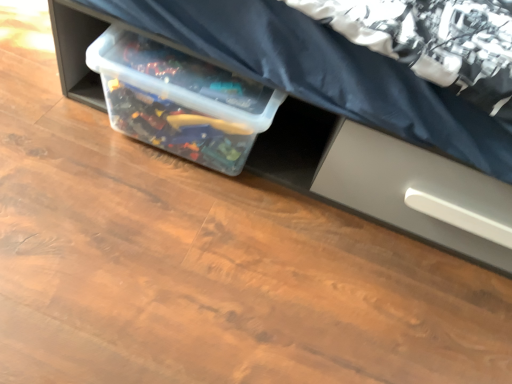
This screenshot has height=384, width=512. I want to click on vacant space to the right of transparent plastic container at center, so click(x=314, y=213).